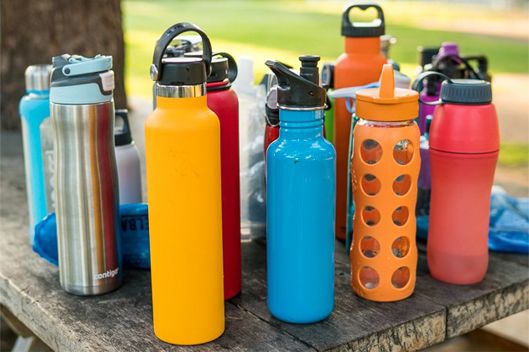
Locate an element on the screen. The image size is (529, 352). wood plank is located at coordinates (242, 337), (380, 339), (489, 306), (519, 257).